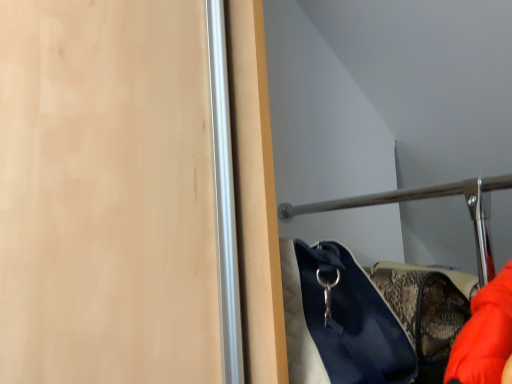
Identify the location of navy blue fabric tote bag at center. (339, 320).

This screenshot has width=512, height=384. What do you see at coordinates (339, 320) in the screenshot? I see `navy blue fabric tote bag at center` at bounding box center [339, 320].

Identify the location of navy blue fabric tote bag at center. The width and height of the screenshot is (512, 384). (339, 320).